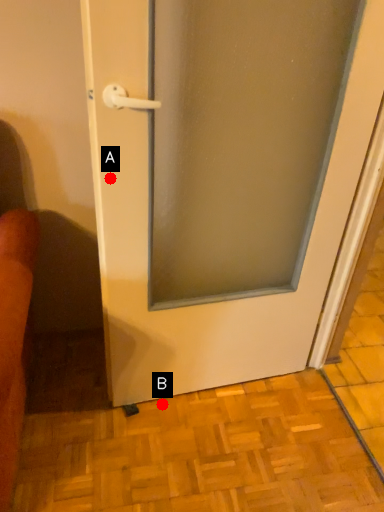
Question: Two points are circled on the image, labeled by A and B beside each circle. Which point is closer to the camera?

Choices:
 (A) A is closer
 (B) B is closer

Answer: (A)